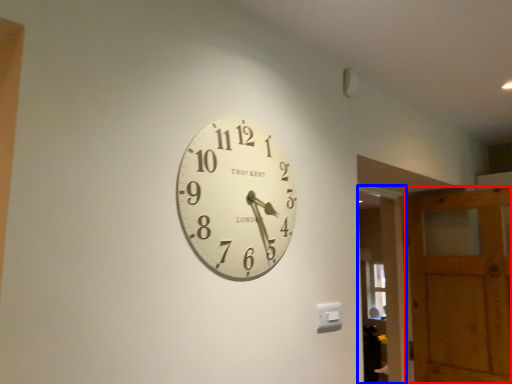
Question: Which object is further to the camera taking this photo, barn door (highlighted by a red box) or glass door (highlighted by a blue box)?

Choices:
 (A) barn door
 (B) glass door

Answer: (B)